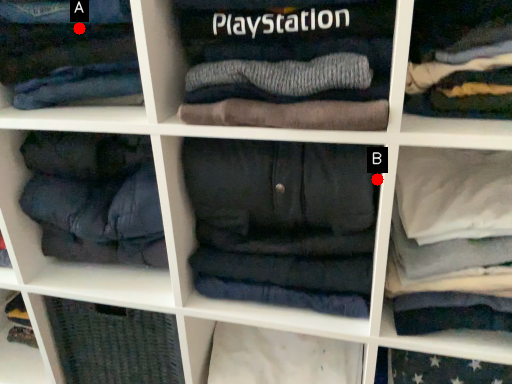
Question: Two points are circled on the image, labeled by A and B beside each circle. Which point is further to the camera?

Choices:
 (A) A is further
 (B) B is further

Answer: (B)